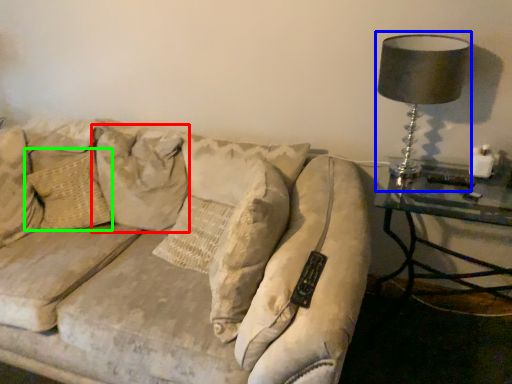
Question: Considering the real-world distances, which object is closest to pillow (highlighted by a red box)? table lamp (highlighted by a blue box) or pillow (highlighted by a green box).

Choices:
 (A) table lamp
 (B) pillow

Answer: (B)